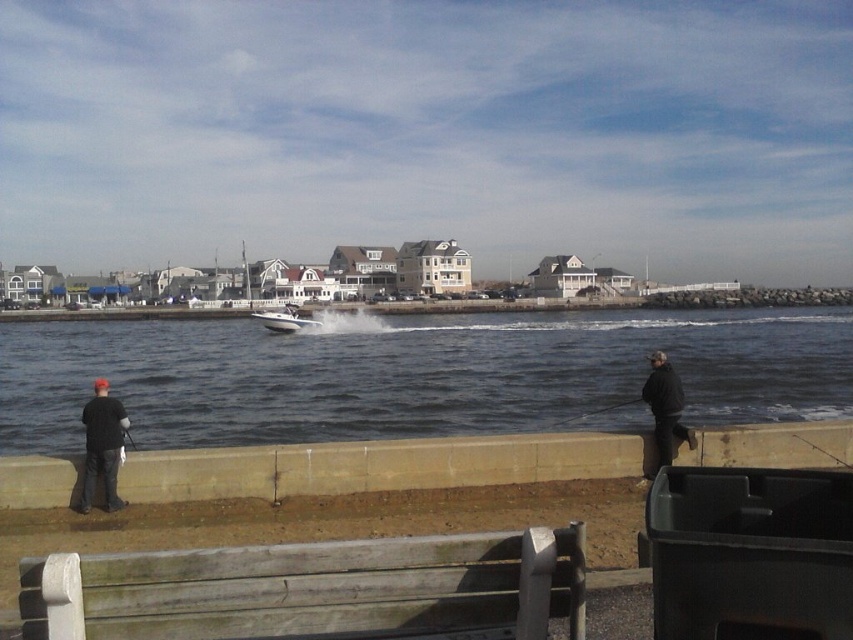
Question: Does dark blue water at center lie in front of weathered wood bench at lower center?

Choices:
 (A) no
 (B) yes

Answer: (A)

Question: Which of the following is the closest to the observer?

Choices:
 (A) (126, 413)
 (B) (630, 401)

Answer: (A)

Question: Which point is closer to the camera taking this photo?

Choices:
 (A) (378, 401)
 (B) (82, 486)
 (C) (688, 436)
 (D) (598, 406)

Answer: (B)

Question: Is weathered wood bench at lower center wider than black matte jacket at lower right?

Choices:
 (A) no
 (B) yes

Answer: (B)

Question: Among these points, which one is farthest from the camera?

Choices:
 (A) (468, 547)
 (B) (660, 388)
 (C) (96, 404)

Answer: (B)

Question: Does weathered wood bench at lower center appear over matte black jacket at left?

Choices:
 (A) yes
 (B) no

Answer: (A)